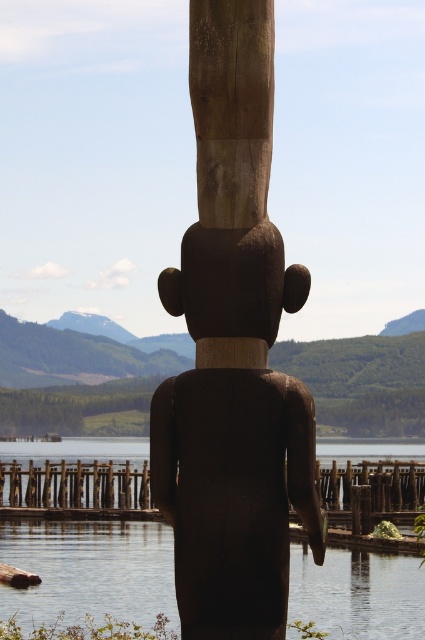
Question: Which of the following is the farthest from the observer?

Choices:
 (A) brown wooden dock at lower center
 (B) brown polished wood totem pole at center

Answer: (A)

Question: Is brown polished wood totem pole at center closer to camera compared to brown wooden dock at lower center?

Choices:
 (A) yes
 (B) no

Answer: (A)

Question: Considering the relative positions of brown polished wood totem pole at center and transparent water at center in the image provided, where is brown polished wood totem pole at center located with respect to transparent water at center?

Choices:
 (A) above
 (B) below

Answer: (A)

Question: Does brown polished wood totem pole at center come in front of transparent water at center?

Choices:
 (A) no
 (B) yes

Answer: (B)

Question: Which of the following is the farthest from the observer?

Choices:
 (A) (198, 467)
 (B) (374, 504)
 (C) (144, 588)

Answer: (B)

Question: Which of these objects is positioned farthest from the brown wooden dock at lower center?

Choices:
 (A) brown polished wood totem pole at center
 (B) transparent water at center

Answer: (A)